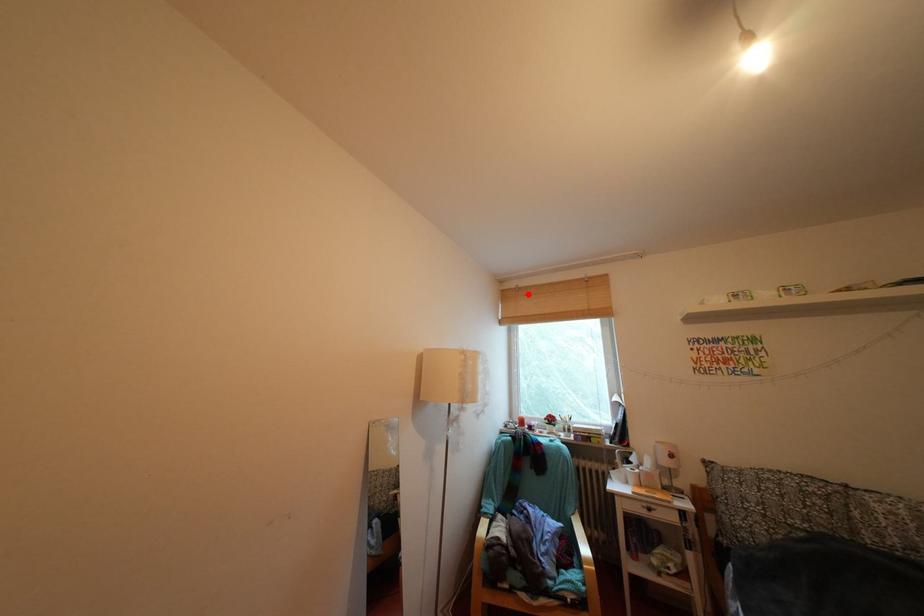
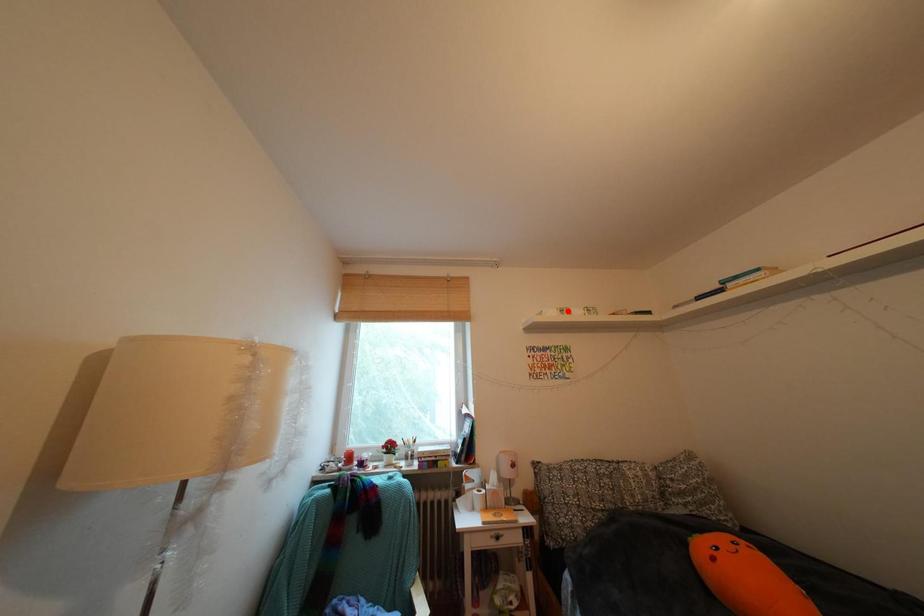
I am providing you with two images of the same scene from different viewpoints. A red point is marked on the first image and another point is marked on the second image. Is the marked point in image1 the same physical position as the marked point in image2?

No